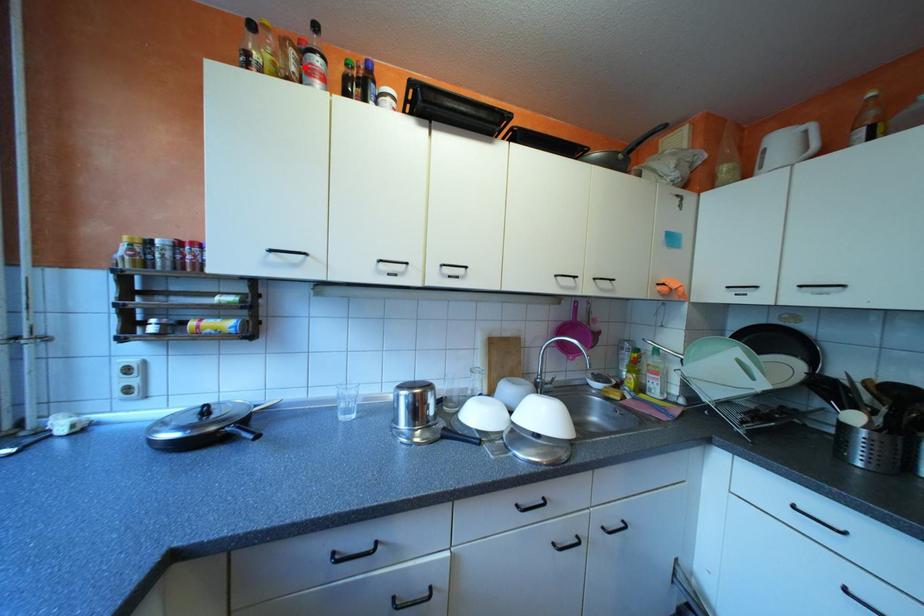
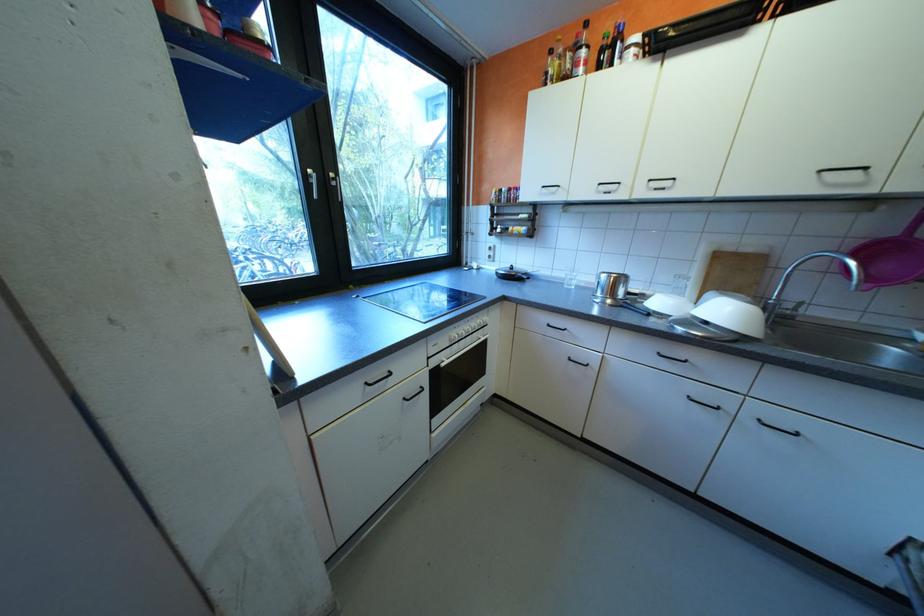
The point at the highlighted location is marked in the first image. Where is the corresponding point in the second image?

(580, 65)